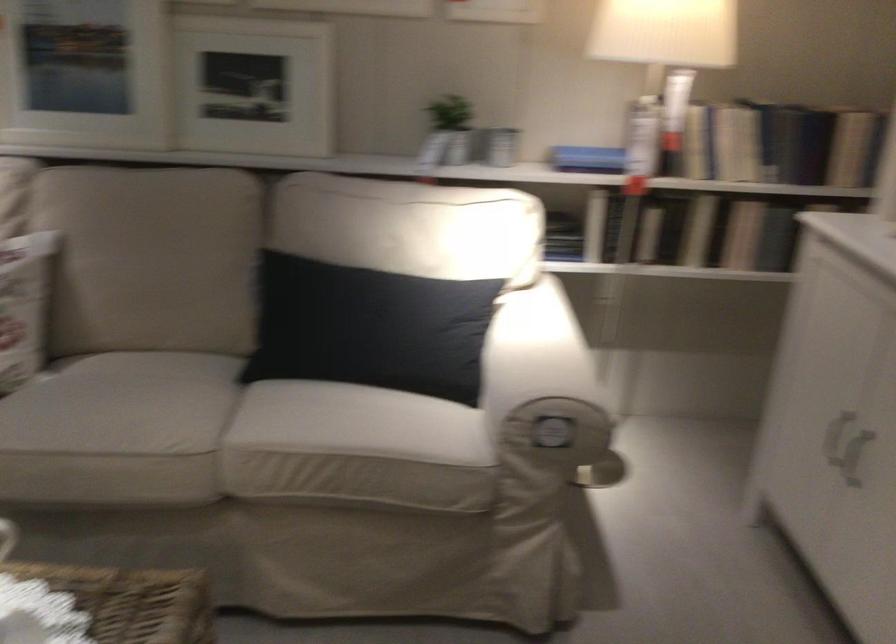
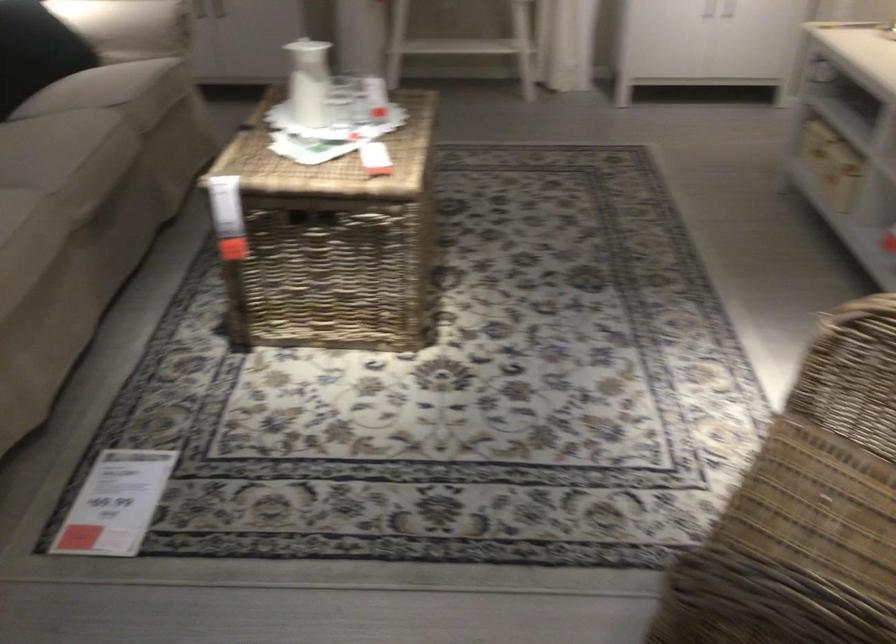
Locate, in the second image, the point that corresponds to point (124, 456) in the first image.

(109, 140)